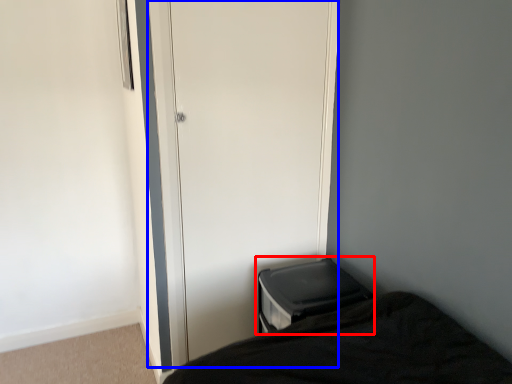
Question: Which of the following is the farthest to the observer, changing table (highlighted by a red box) or screen door (highlighted by a blue box)?

Choices:
 (A) changing table
 (B) screen door

Answer: (A)